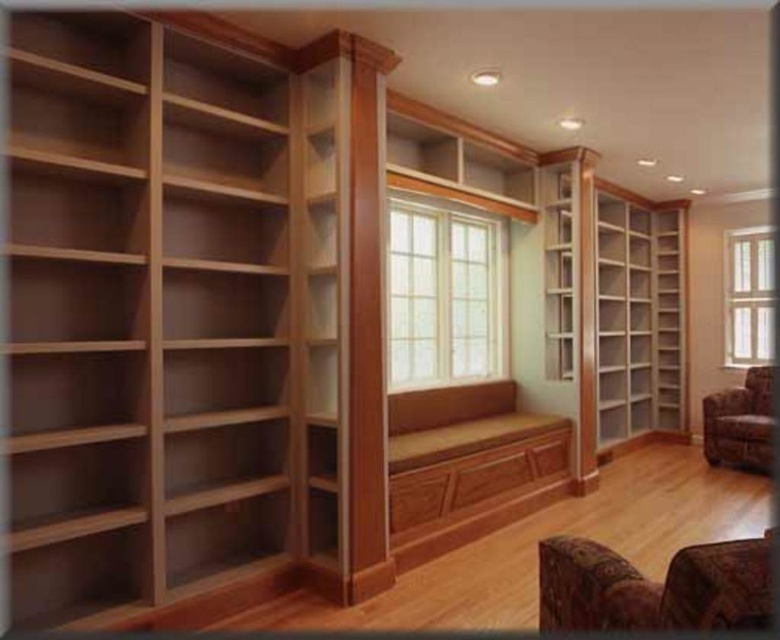
The image size is (780, 640). What are the coordinates of `brown patterned fabric armchair at lower right` in the screenshot? It's located at (654, 588).

Can you confirm if brown patterned fabric armchair at lower right is positioned to the right of clear glass window at right?

No, brown patterned fabric armchair at lower right is not to the right of clear glass window at right.

What are the coordinates of `brown patterned fabric armchair at lower right` in the screenshot? It's located at (654, 588).

Is point (741, 602) positioned before point (736, 451)?

That is True.

Identify the location of brown patterned fabric armchair at lower right. The width and height of the screenshot is (780, 640). (654, 588).

Between clear glass window at center and velvet floral armchair at lower right, which one is positioned higher?

clear glass window at center is above.

Who is more forward, (459, 269) or (757, 467)?

Point (459, 269) is more forward.

Locate an element on the screen. This screenshot has height=640, width=780. clear glass window at center is located at coordinates (442, 296).